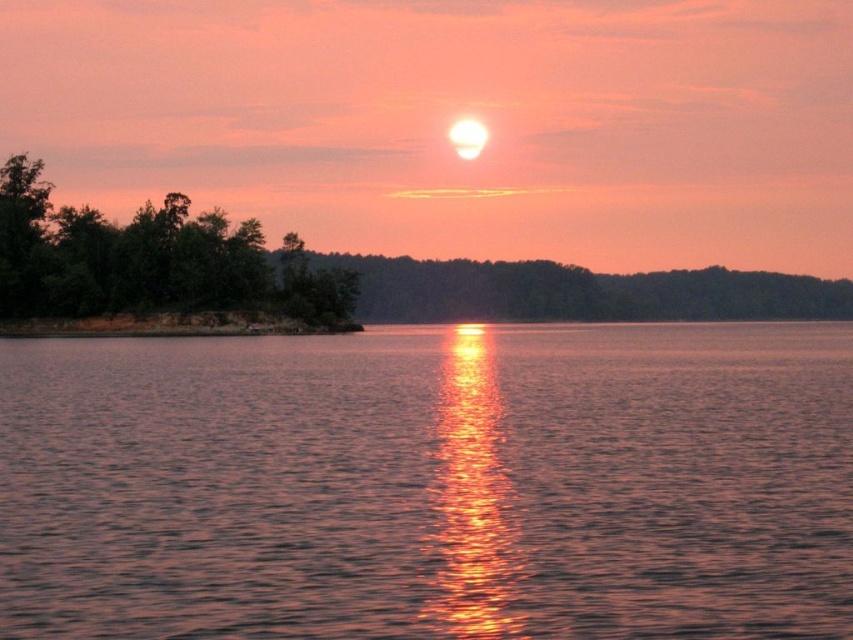
Is point (3, 465) positioned in front of point (36, 186)?

Yes, point (3, 465) is closer to viewer.

Describe the element at coordinates (430, 484) in the screenshot. I see `shiny reflective water at center` at that location.

You are a GUI agent. You are given a task and a screenshot of the screen. Output one action in this format:
    pyautogui.click(x=<x>, y=<y>)
    Task: Click on the shiny reflective water at center
    The height and width of the screenshot is (640, 853).
    Given the screenshot: What is the action you would take?
    pyautogui.click(x=430, y=484)